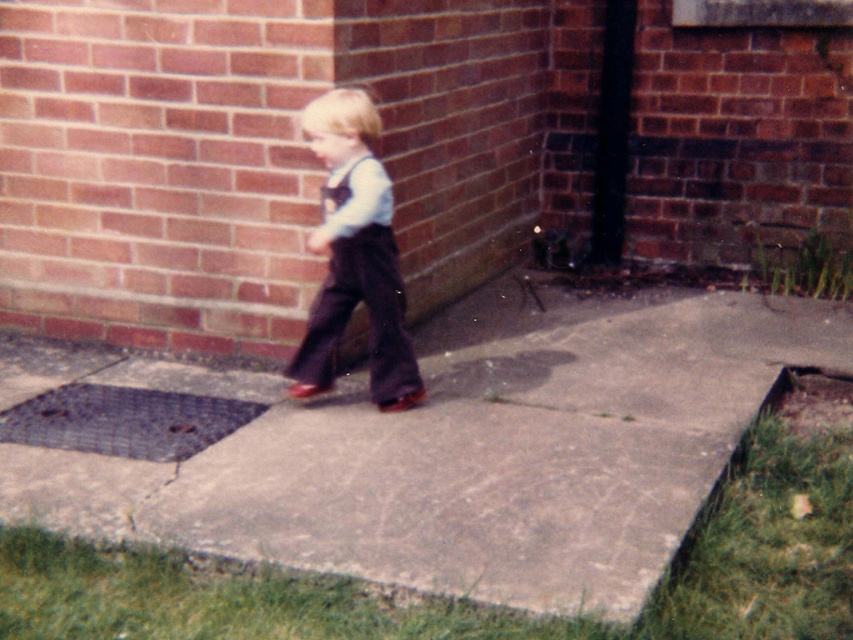
Question: Estimate the real-world distances between objects in this image. Which object is farther from the white fabric suspenders at center?

Choices:
 (A) brown corduroy overalls at center
 (B) gray concrete at center

Answer: (B)

Question: In this image, where is brown corduroy overalls at center located relative to white fabric suspenders at center?

Choices:
 (A) left
 (B) right

Answer: (A)

Question: Does gray concrete at center appear over white fabric suspenders at center?

Choices:
 (A) no
 (B) yes

Answer: (A)

Question: Which object is the closest to the gray concrete at center?

Choices:
 (A) white fabric suspenders at center
 (B) brown corduroy overalls at center

Answer: (B)

Question: Which point is farther to the camera?

Choices:
 (A) (346, 186)
 (B) (41, 452)
 (C) (399, 381)

Answer: (C)

Question: Does brown corduroy overalls at center have a lesser width compared to white fabric suspenders at center?

Choices:
 (A) no
 (B) yes

Answer: (A)